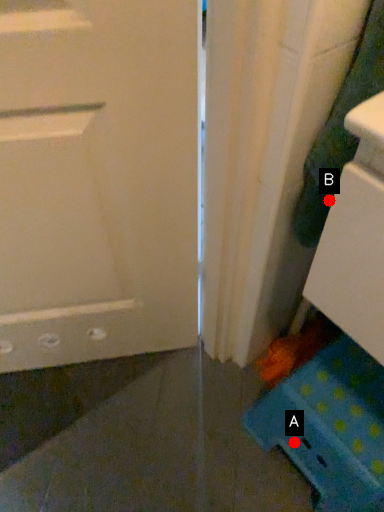
Question: Two points are circled on the image, labeled by A and B beside each circle. Which point is farther from the camera taking this photo?

Choices:
 (A) A is further
 (B) B is further

Answer: (A)